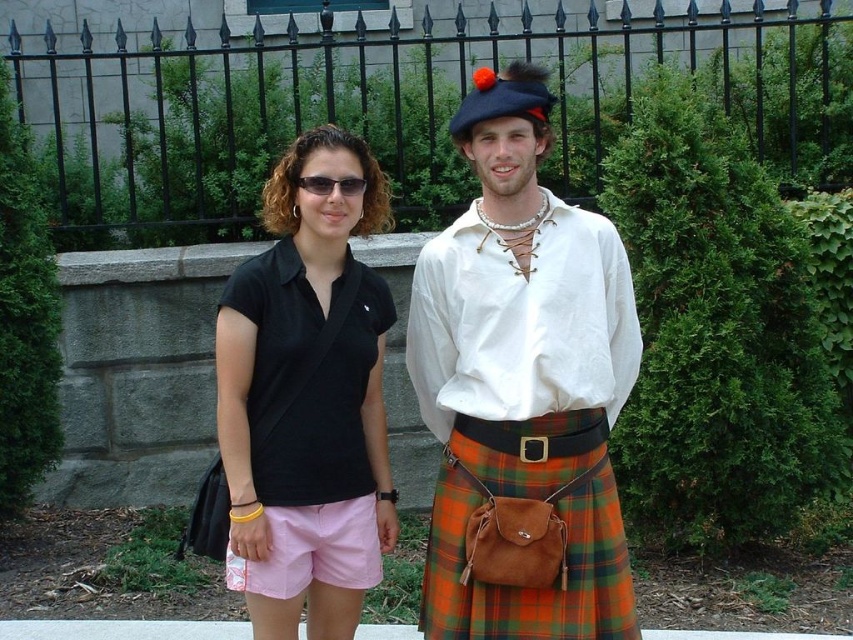
Question: Which point is farther to the camera?

Choices:
 (A) (396, 538)
 (B) (456, 529)

Answer: (A)

Question: Which point is farther from the camera taking this photo?

Choices:
 (A) tap(271, 300)
 (B) tap(474, 451)
 (C) tap(345, 540)
 (D) tap(550, 500)

Answer: (C)

Question: Estimate the real-world distances between objects in this image. Which object is farther from the matte black sunglasses at center?

Choices:
 (A) matte white shirt at center
 (B) pink cotton shorts at center
 (C) black matte shirt at center

Answer: (B)

Question: Is plaid wool kilt at center thinner than pink cotton shorts at center?

Choices:
 (A) no
 (B) yes

Answer: (A)

Question: Considering the relative positions of matte white shirt at center and matte black sunglasses at center in the image provided, where is matte white shirt at center located with respect to matte black sunglasses at center?

Choices:
 (A) left
 (B) right

Answer: (B)

Question: Does black matte shirt at center appear on the right side of plaid wool kilt at center?

Choices:
 (A) yes
 (B) no

Answer: (B)